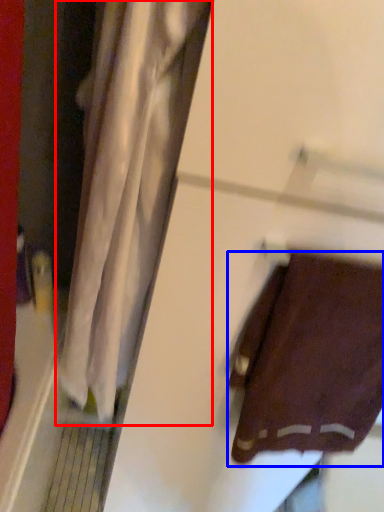
Question: Among these objects, which one is farthest to the camera, curtain (highlighted by a red box) or towel (highlighted by a blue box)?

Choices:
 (A) curtain
 (B) towel

Answer: (B)